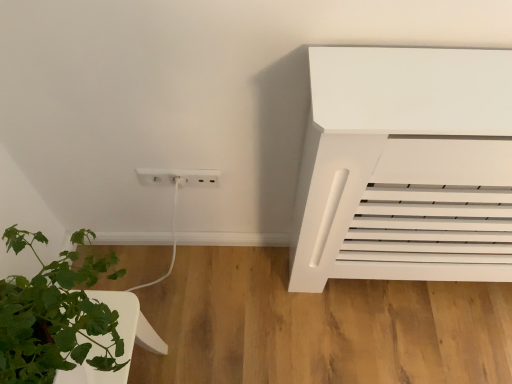
Question: Is green leafy plant at lower left surrounding white plastic outlet at lower center?

Choices:
 (A) yes
 (B) no

Answer: (B)

Question: Does green leafy plant at lower left have a smaller size compared to white plastic outlet at lower center?

Choices:
 (A) no
 (B) yes

Answer: (A)

Question: Is green leafy plant at lower left wider than white plastic outlet at lower center?

Choices:
 (A) yes
 (B) no

Answer: (A)

Question: Would you say green leafy plant at lower left is outside white plastic outlet at lower center?

Choices:
 (A) yes
 (B) no

Answer: (A)

Question: From the image's perspective, is green leafy plant at lower left on white plastic outlet at lower center?

Choices:
 (A) yes
 (B) no

Answer: (B)

Question: From a real-world perspective, is green leafy plant at lower left located higher than white plastic outlet at lower center?

Choices:
 (A) no
 (B) yes

Answer: (A)

Question: Considering the relative positions of white plastic outlet at lower center and green leafy plant at lower left in the image provided, is white plastic outlet at lower center to the right of green leafy plant at lower left from the viewer's perspective?

Choices:
 (A) yes
 (B) no

Answer: (A)

Question: Is the surface of white plastic outlet at lower center in direct contact with green leafy plant at lower left?

Choices:
 (A) no
 (B) yes

Answer: (A)

Question: Is white plastic outlet at lower center in front of green leafy plant at lower left?

Choices:
 (A) no
 (B) yes

Answer: (A)

Question: From a real-world perspective, does white plastic outlet at lower center stand above green leafy plant at lower left?

Choices:
 (A) no
 (B) yes

Answer: (B)

Question: Could you tell me if white plastic outlet at lower center is facing green leafy plant at lower left?

Choices:
 (A) no
 (B) yes

Answer: (A)

Question: Is white plastic outlet at lower center wider than green leafy plant at lower left?

Choices:
 (A) yes
 (B) no

Answer: (B)

Question: From a real-world perspective, is white plastic outlet at lower center above or below green leafy plant at lower left?

Choices:
 (A) above
 (B) below

Answer: (A)